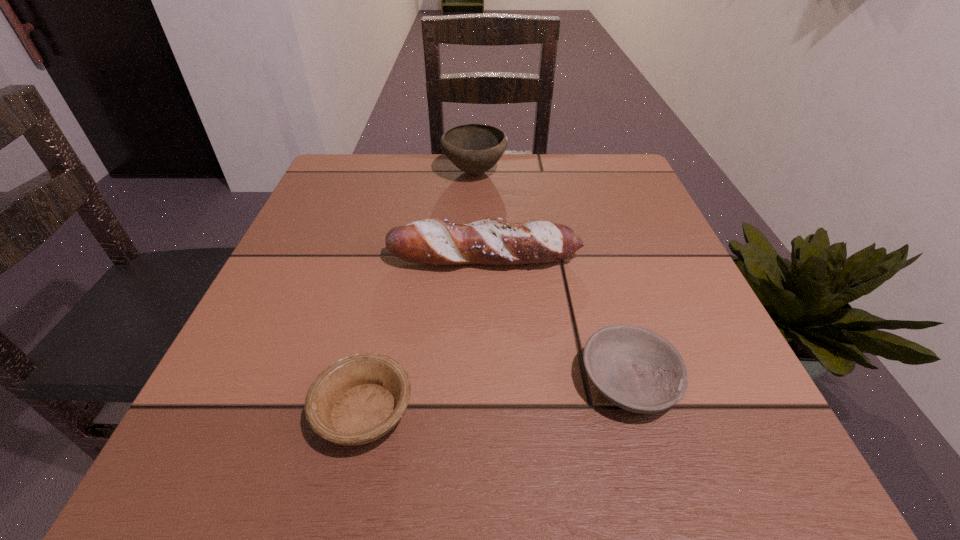
Find the location of a particular element. This screenshot has width=960, height=540. blank space at the near right corner is located at coordinates (751, 442).

Locate an element on the screen. Image resolution: width=960 pixels, height=540 pixels. vacant area that lies between the tallest object and the third shortest object is located at coordinates pyautogui.click(x=479, y=215).

The width and height of the screenshot is (960, 540). Find the location of `vacant space in between the baguet and the rightmost bowl`. vacant space in between the baguet and the rightmost bowl is located at coordinates (557, 320).

Identify the location of vacant area between the tallest object and the rightmost bowl. (551, 277).

Where is `free space between the tallest bowl and the second tallest object`? free space between the tallest bowl and the second tallest object is located at coordinates (479, 215).

You are a GUI agent. You are given a task and a screenshot of the screen. Output one action in this format:
    pyautogui.click(x=<x>, y=<y>)
    Task: Click on the free point between the third nearest object and the rightmost bowl
    This screenshot has width=960, height=540.
    Given the screenshot: What is the action you would take?
    pyautogui.click(x=557, y=320)

You are a GUI agent. You are given a task and a screenshot of the screen. Output one action in this format:
    pyautogui.click(x=<x>, y=<y>)
    Task: Click on the object that is the second closest one to the second tallest object
    This screenshot has height=540, width=960.
    Given the screenshot: What is the action you would take?
    point(474,148)

Choose which object is the second nearest neighbor to the rightmost bowl. Please provide its 2D coordinates. Your answer should be formatted as a tuple, i.e. [(x, y)], where the tuple contains the x and y coordinates of a point satisfying the conditions above.

[(358, 399)]

Identify which bowl is the second nearest to the third shortest object. Please provide its 2D coordinates. Your answer should be formatted as a tuple, i.e. [(x, y)], where the tuple contains the x and y coordinates of a point satisfying the conditions above.

[(474, 148)]

This screenshot has width=960, height=540. I want to click on bowl that is the closest to the rightmost bowl, so click(358, 399).